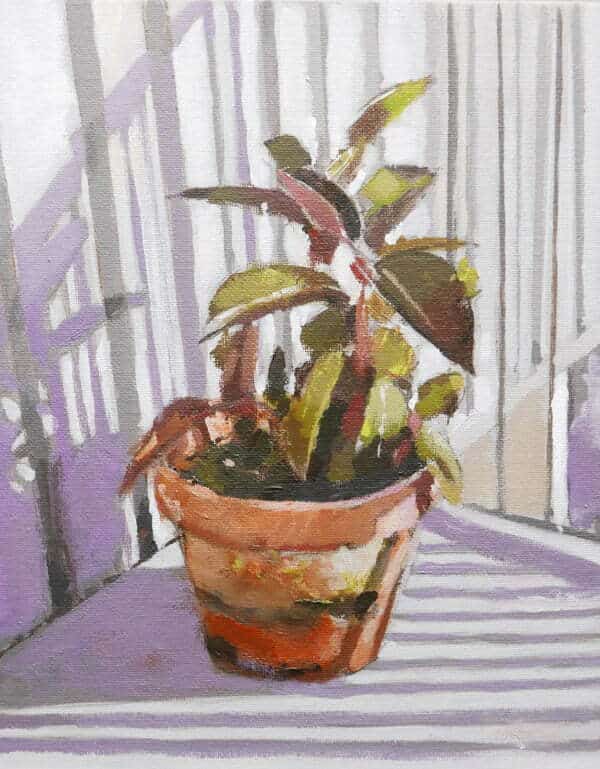
Identify the location of shadow of pot of painted plant. (75, 523).